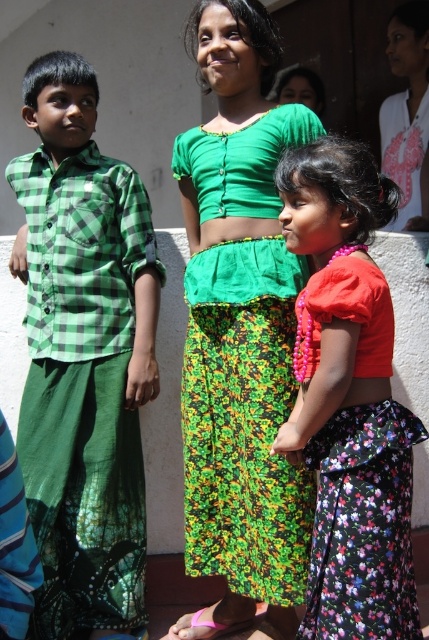
Can you confirm if green checkered shirt at left is positioned below floral satin skirt at center?

No, green checkered shirt at left is not below floral satin skirt at center.

I want to click on green checkered shirt at left, so click(84, 355).

Who is positioned more to the right, green checkered shirt at left or green woven skirt at center?

Answer: Positioned to the right is green woven skirt at center.

Is point (114, 483) behind point (251, 376)?

Yes, point (114, 483) is behind point (251, 376).

Between point (45, 96) and point (189, 460), which one is positioned in front?

Point (189, 460) is more forward.

Find the location of a particular element. green checkered shirt at left is located at coordinates (84, 355).

Is green checkered shirt at left above white cotton shirt at upper right?

Incorrect, green checkered shirt at left is not positioned above white cotton shirt at upper right.

Where is `green checkered shirt at left`? This screenshot has height=640, width=429. green checkered shirt at left is located at coordinates (84, 355).

Image resolution: width=429 pixels, height=640 pixels. What are the coordinates of `green checkered shirt at left` in the screenshot? It's located at (84, 355).

Locate an element on the screen. Image resolution: width=429 pixels, height=640 pixels. green checkered shirt at left is located at coordinates (84, 355).